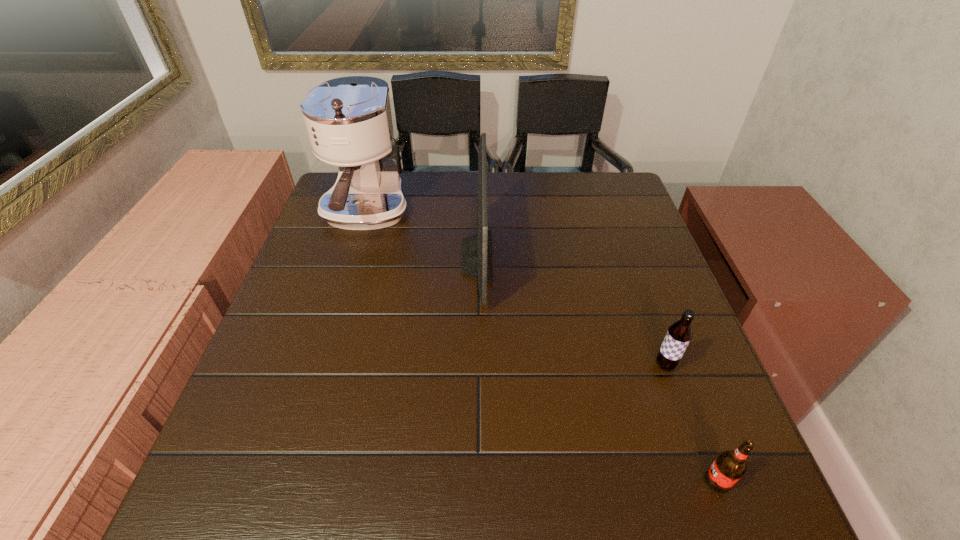
In order to click on empty space between the taller root beer and the shorter root beer in this screenshot , I will do click(x=691, y=423).

Where is `vacant region between the nearer root beer and the monitor`? This screenshot has height=540, width=960. vacant region between the nearer root beer and the monitor is located at coordinates (597, 369).

Locate an element on the screen. blank region between the taller root beer and the shortest object is located at coordinates (691, 423).

Identify the location of object that is the second closest to the shorter root beer. The image size is (960, 540). (476, 262).

Where is `the second closest object relative to the coffee maker`? the second closest object relative to the coffee maker is located at coordinates (679, 334).

At what (x,y) coordinates should I click in order to perform the action: click on free location that satisfies the following two spatial constraints: 1. on the screen side of the shortest object; 2. on the right side of the monitor. Please return your answer as a coordinate pair (x, y). The image size is (960, 540). Looking at the image, I should click on (475, 481).

This screenshot has width=960, height=540. I want to click on vacant space that satisfies the following two spatial constraints: 1. on the screen side of the third farthest object; 2. on the left side of the third object from right to left, so click(x=476, y=365).

Find the location of a particular element. This screenshot has height=540, width=960. free spot that satisfies the following two spatial constraints: 1. on the screen side of the monitor; 2. on the back side of the shortest object is located at coordinates (475, 481).

Identify the location of free spot that satisfies the following two spatial constraints: 1. on the front-facing side of the coffee maker; 2. on the right side of the shortest object. The image size is (960, 540). (283, 481).

At what (x,y) coordinates should I click in order to perform the action: click on vacant position in the image that satisfies the following two spatial constraints: 1. on the front-facing side of the coffee maker; 2. on the left side of the nearer root beer. Please return your answer as a coordinate pair (x, y). The height and width of the screenshot is (540, 960). Looking at the image, I should click on tap(283, 481).